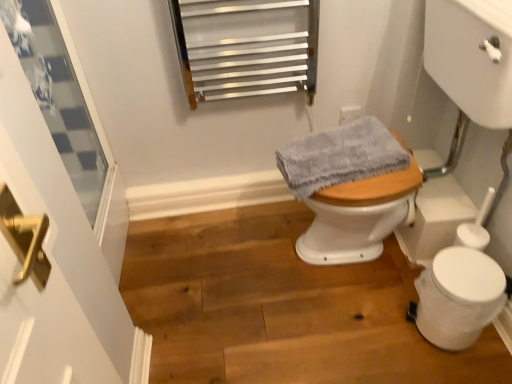
Question: From the image's perspective, is white glossy sink at right below gray fabric at center?

Choices:
 (A) yes
 (B) no

Answer: (B)

Question: Is white glossy sink at right oriented away from gray fabric at center?

Choices:
 (A) no
 (B) yes

Answer: (B)

Question: Does white glossy sink at right have a greater width compared to gray fabric at center?

Choices:
 (A) no
 (B) yes

Answer: (B)

Question: Can you confirm if white glossy sink at right is smaller than gray fabric at center?

Choices:
 (A) yes
 (B) no

Answer: (B)

Question: Considering the relative sizes of white glossy sink at right and gray fabric at center in the image provided, is white glossy sink at right thinner than gray fabric at center?

Choices:
 (A) yes
 (B) no

Answer: (B)

Question: From a real-world perspective, is white glossy sink at right beneath gray fabric at center?

Choices:
 (A) no
 (B) yes

Answer: (A)

Question: Can you confirm if clear glass window at upper left is thinner than gray fabric at center?

Choices:
 (A) yes
 (B) no

Answer: (A)

Question: Is gray fabric at center a part of clear glass window at upper left?

Choices:
 (A) yes
 (B) no

Answer: (B)

Question: Is clear glass window at upper left further to camera compared to gray fabric at center?

Choices:
 (A) no
 (B) yes

Answer: (A)

Question: From the image's perspective, is clear glass window at upper left located beneath gray fabric at center?

Choices:
 (A) yes
 (B) no

Answer: (B)

Question: Is clear glass window at upper left next to gray fabric at center?

Choices:
 (A) no
 (B) yes

Answer: (A)

Question: Is clear glass window at upper left bigger than gray fabric at center?

Choices:
 (A) yes
 (B) no

Answer: (A)

Question: From a real-world perspective, is clear glass window at upper left physically below white plastic toilet bowl at lower right?

Choices:
 (A) no
 (B) yes

Answer: (A)